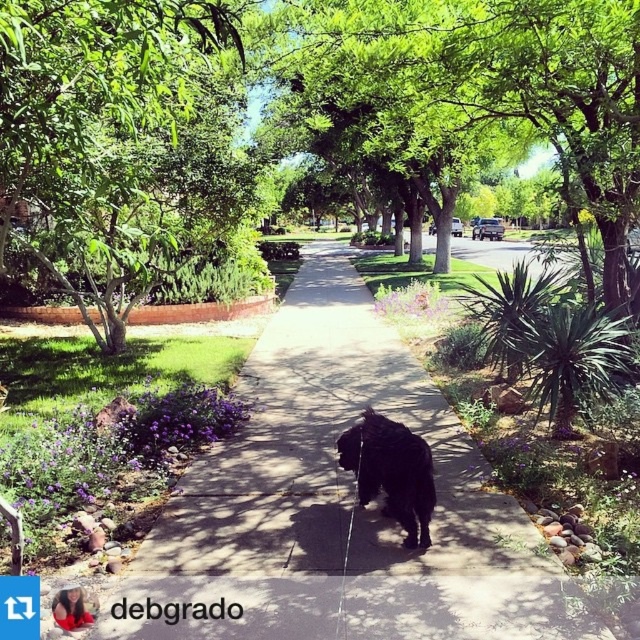
Question: Based on their relative distances, which object is farther from the smooth concrete sidewalk at center?

Choices:
 (A) green leafy tree at center
 (B) green leafy tree at upper left

Answer: (B)

Question: Does green leafy tree at center appear on the left side of black fur dog at center?

Choices:
 (A) no
 (B) yes

Answer: (A)

Question: Which point appears farthest from the camera in this image?

Choices:
 (A) (320, 470)
 (B) (115, 248)

Answer: (B)

Question: Which object appears farthest from the camera in this image?

Choices:
 (A) smooth concrete sidewalk at center
 (B) green leafy tree at center
 (C) black fur dog at center
 (D) green leafy tree at upper left

Answer: (D)

Question: Is smooth concrete sidewalk at center above green leafy tree at upper left?

Choices:
 (A) yes
 (B) no

Answer: (B)

Question: From the image, what is the correct spatial relationship of green leafy tree at center in relation to green leafy tree at upper left?

Choices:
 (A) above
 (B) below

Answer: (A)